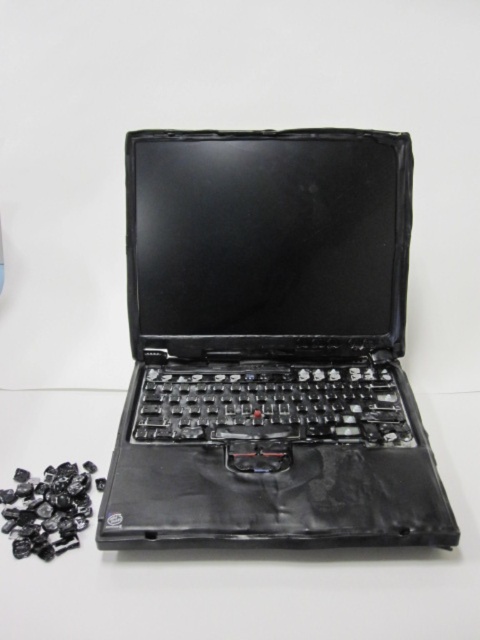
Can you confirm if matte black laptop at center is positioned to the right of black plastic keyboard at lower center?

Correct, you'll find matte black laptop at center to the right of black plastic keyboard at lower center.

Which of these two, matte black laptop at center or black plastic keyboard at lower center, stands shorter?

With less height is black plastic keyboard at lower center.

Is point (299, 220) behind point (295, 625)?

Yes, point (299, 220) is farther from viewer.

You are a GUI agent. You are given a task and a screenshot of the screen. Output one action in this format:
    pyautogui.click(x=<x>, y=<y>)
    Task: Click on the matte black laptop at center
    The image size is (480, 640).
    Given the screenshot: What is the action you would take?
    pyautogui.click(x=269, y=346)